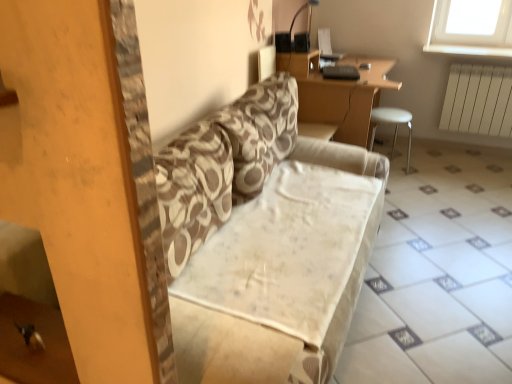
Question: In the image, is white plastic radiator at right positioned in front of or behind patterned fabric couch at center?

Choices:
 (A) behind
 (B) front

Answer: (A)

Question: Would you say white plastic radiator at right is inside or outside patterned fabric couch at center?

Choices:
 (A) outside
 (B) inside

Answer: (A)

Question: Which object is the farthest from the beige fabric ottoman at center?

Choices:
 (A) white plastic stool at right
 (B) patterned fabric couch at center
 (C) white plastic radiator at right
 (D) wooden desk at upper center

Answer: (C)

Question: Based on their relative distances, which object is farther from the beige fabric ottoman at center?

Choices:
 (A) wooden desk at upper center
 (B) patterned fabric couch at center
 (C) white plastic stool at right
 (D) white plastic radiator at right

Answer: (D)